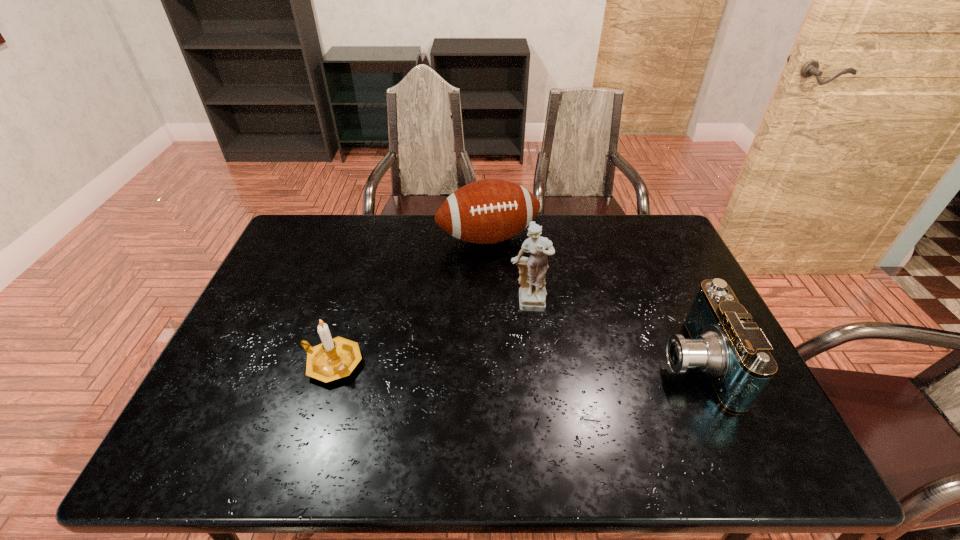
Where is `object situated at the near right corner`? object situated at the near right corner is located at coordinates (724, 343).

Where is `vacant position at the far edge of the desktop`? The image size is (960, 540). vacant position at the far edge of the desktop is located at coordinates (562, 225).

In the image, there is a desktop. At what (x,y) coordinates should I click in order to perform the action: click on vacant space at the near edge. Please return your answer as a coordinate pair (x, y). Looking at the image, I should click on coord(641,417).

Locate an element on the screen. vacant space at the left edge of the desktop is located at coordinates pos(287,331).

In the image, there is a desktop. In order to click on vacant space at the right edge in this screenshot , I will do `click(676, 297)`.

Locate an element on the screen. This screenshot has width=960, height=540. vacant region at the far left corner of the desktop is located at coordinates (300, 253).

At what (x,y) coordinates should I click in order to perform the action: click on vacant point at the near left corner. Please return your answer as a coordinate pair (x, y). This screenshot has width=960, height=540. Looking at the image, I should click on 265,408.

The height and width of the screenshot is (540, 960). I want to click on vacant area at the near right corner, so click(709, 406).

I want to click on free area in between the farthest object and the rightmost object, so click(590, 300).

Locate an element on the screen. Image resolution: width=960 pixels, height=540 pixels. blank region between the figurine and the farthest object is located at coordinates (508, 272).